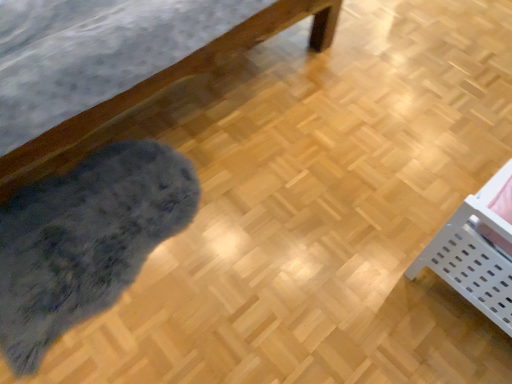
This screenshot has height=384, width=512. I want to click on free space to the back side of fuzzy gray mat at lower left, so pos(196,118).